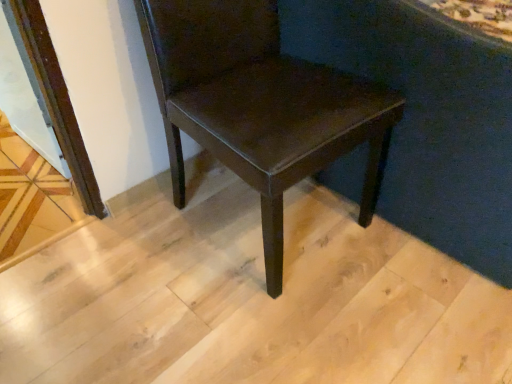
Where is `free spot below matte dark brown chair at center (from a real-world perspective)`? free spot below matte dark brown chair at center (from a real-world perspective) is located at coordinates (258, 215).